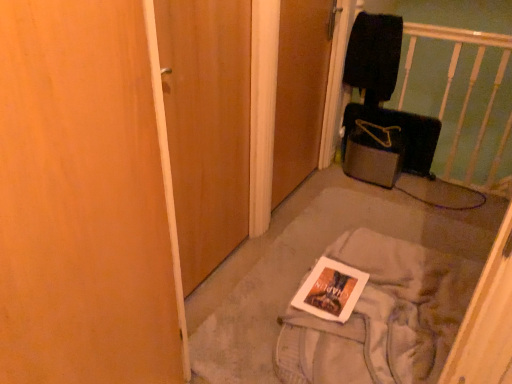
At what (x,y) coordinates should I click in order to perform the action: click on velvet black suitcase at right. Please return your answer as a coordinate pair (x, y). Looking at the image, I should click on coord(402,132).

The height and width of the screenshot is (384, 512). What do you see at coordinates (402, 132) in the screenshot?
I see `velvet black suitcase at right` at bounding box center [402, 132].

The height and width of the screenshot is (384, 512). Describe the element at coordinates (300, 91) in the screenshot. I see `wooden door at center, which is counted as the 1th door, starting from the right` at that location.

Where is `velvet black suitcase at right`? velvet black suitcase at right is located at coordinates (402, 132).

Is white paper at center in front of white glossy magazine at center?

Yes, it is in front of white glossy magazine at center.

From a real-world perspective, does white paper at center sit lower than white glossy magazine at center?

Correct, in the physical world, white paper at center is lower than white glossy magazine at center.

Does point (421, 313) come closer to viewer compared to point (345, 280)?

Yes, point (421, 313) is in front of point (345, 280).

Is white glossy magazine at center surrounded by white paper at center?

Yes.

Is wooden door at center, which is counted as the 1th door, starting from the right, aimed at white fabric book at center?

No, wooden door at center, which is counted as the 1th door, starting from the right, does not turn towards white fabric book at center.

Does wooden door at center, which is counted as the 1th door, starting from the right, have a greater height compared to white fabric book at center?

Indeed, wooden door at center, which is counted as the 1th door, starting from the right, has a greater height compared to white fabric book at center.

From a real-world perspective, between wooden door at center, which is the 2th door in left-to-right order, and white fabric book at center, who is vertically lower?

From a 3D spatial view, white fabric book at center is below.

Is white fabric book at center inside wooden door at center, which is counted as the 1th door, starting from the right?

Definitely not — white fabric book at center is not inside wooden door at center, which is counted as the 1th door, starting from the right.

From the picture: Which of these two, wooden door at center, which is counted as the 1th door, starting from the right, or white paper at center, is wider?

white paper at center is wider.

From a real-world perspective, is wooden door at center, which is counted as the 1th door, starting from the right, over white paper at center?

Yes.

Looking at this image, how far apart are velvet black suitcase at right and wooden door at center, the 2th door when ordered from right to left?

velvet black suitcase at right is 1.33 meters away from wooden door at center, the 2th door when ordered from right to left.

Considering the relative positions of velvet black suitcase at right and wooden door at center, the 2th door when ordered from right to left, in the image provided, is velvet black suitcase at right to the right of wooden door at center, the 2th door when ordered from right to left, from the viewer's perspective?

Correct, you'll find velvet black suitcase at right to the right of wooden door at center, the 2th door when ordered from right to left.

Between velvet black suitcase at right and wooden door at center, the 1th door when ordered from left to right, which one has less height?

velvet black suitcase at right is shorter.

Which is correct: velvet black suitcase at right is inside wooden door at center, the 2th door when ordered from right to left, or outside of it?

The correct answer is: outside.

Does point (294, 307) appear closer or farther from the camera than point (494, 169)?

Point (294, 307) is positioned closer to the camera compared to point (494, 169).

Which of these two, white glossy magazine at center or black fabric infant bed at upper right, is bigger?

black fabric infant bed at upper right is bigger.

Is white glossy magazine at center beside black fabric infant bed at upper right?

white glossy magazine at center and black fabric infant bed at upper right are clearly separated.

How different are the orientations of white glossy magazine at center and black fabric infant bed at upper right in degrees?

There is a 88.6-degree angle between the facing directions of white glossy magazine at center and black fabric infant bed at upper right.

Is point (346, 306) positioned in front of point (358, 117)?

Yes, it is.

Does white glossy magazine at center have a lesser width compared to velvet black suitcase at right?

In fact, white glossy magazine at center might be wider than velvet black suitcase at right.

From the image's perspective, is white glossy magazine at center above or below velvet black suitcase at right?

white glossy magazine at center is below velvet black suitcase at right.

Is white glossy magazine at center inside the boundaries of velvet black suitcase at right, or outside?

white glossy magazine at center is outside velvet black suitcase at right.

Identify the location of the 2nd door counting from the left side of the white fabric book at center. (207, 126).

From a real-world perspective, is white fabric book at center located higher than wooden door at center, the 1th door when ordered from left to right?

Incorrect, from a real-world perspective, white fabric book at center is lower than wooden door at center, the 1th door when ordered from left to right.

Based on the photo, does white fabric book at center contain wooden door at center, the 1th door when ordered from left to right?

Result: No, wooden door at center, the 1th door when ordered from left to right, is not surrounded by white fabric book at center.

Image resolution: width=512 pixels, height=384 pixels. Identify the location of material in front of the white glossy magazine at center. (380, 318).

There is a white fabric book at center. Identify the location of the 2nd door above it (from the image's perspective). (300, 91).

From the image, which object appears to be nearer to wooden door at center, which is counted as the 1th door, starting from the right, black fabric infant bed at upper right or velvet black suitcase at right?

Based on the image, black fabric infant bed at upper right appears to be nearer to wooden door at center, which is counted as the 1th door, starting from the right.

From the image, which object appears to be nearer to wooden door at center, the 1th door when ordered from left to right, black fabric infant bed at upper right or velvet black suitcase at right?

black fabric infant bed at upper right is positioned closer to the anchor wooden door at center, the 1th door when ordered from left to right.

Based on their spatial positions, is black fabric infant bed at upper right or wooden door at center, the 1th door when ordered from left to right, closer to white fabric book at center?

black fabric infant bed at upper right lies closer to white fabric book at center than the other object.

Estimate the real-world distances between objects in this image. Which object is closer to wooden door at center, which is counted as the 1th door, starting from the right, white paper at center or white glossy magazine at center?

Based on the image, white glossy magazine at center appears to be nearer to wooden door at center, which is counted as the 1th door, starting from the right.

Which object lies nearer to the anchor point wooden door at center, the 1th door when ordered from left to right, velvet black suitcase at right or white fabric book at center?

white fabric book at center is closer to wooden door at center, the 1th door when ordered from left to right.

Based on their spatial positions, is white glossy magazine at center or velvet black suitcase at right further from wooden door at center, which is counted as the 1th door, starting from the right?

The object further to wooden door at center, which is counted as the 1th door, starting from the right, is white glossy magazine at center.

Which object lies nearer to the anchor point white glossy magazine at center, wooden door at center, the 2th door when ordered from right to left, or black fabric infant bed at upper right?

The object closer to white glossy magazine at center is wooden door at center, the 2th door when ordered from right to left.

Estimate the real-world distances between objects in this image. Which object is further from wooden door at center, the 2th door when ordered from right to left, white glossy magazine at center or wooden door at center, which is counted as the 1th door, starting from the right?

white glossy magazine at center lies further to wooden door at center, the 2th door when ordered from right to left, than the other object.

Identify the location of infant bed between white paper at center and velvet black suitcase at right in the front-back direction. (405, 95).

Image resolution: width=512 pixels, height=384 pixels. Find the location of `door located between wooden door at center, the 2th door when ordered from right to left, and velvet black suitcase at right in the depth direction`. door located between wooden door at center, the 2th door when ordered from right to left, and velvet black suitcase at right in the depth direction is located at coordinates (300, 91).

This screenshot has width=512, height=384. I want to click on magazine that lies between wooden door at center, which is the 2th door in left-to-right order, and white paper at center from top to bottom, so pyautogui.click(x=330, y=290).

The image size is (512, 384). What are the coordinates of `infant bed between wooden door at center, the 2th door when ordered from right to left, and velvet black suitcase at right from front to back` in the screenshot? It's located at (405, 95).